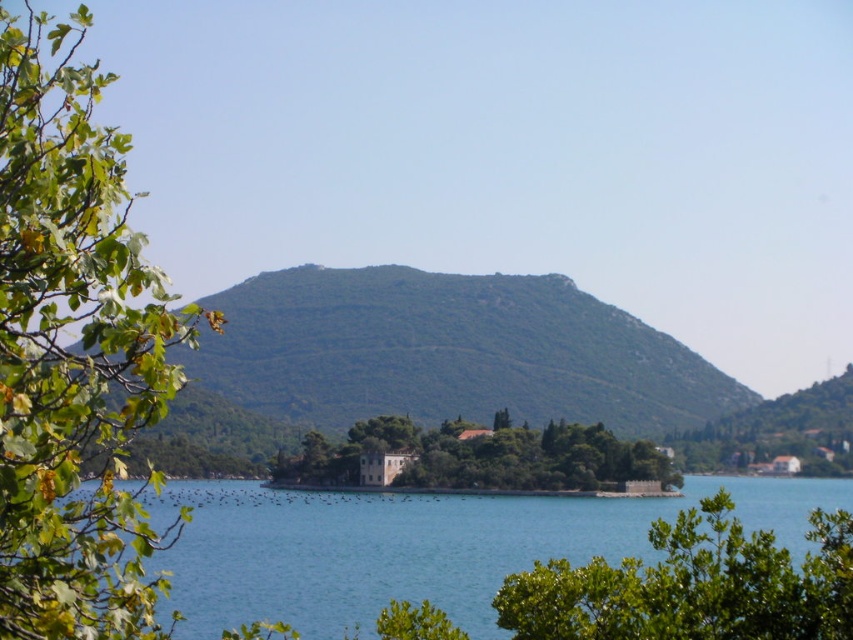
Question: Is green leafy tree at left to the left of clear blue water at center from the viewer's perspective?

Choices:
 (A) no
 (B) yes

Answer: (B)

Question: Which object is positioned closest to the clear blue water at center?

Choices:
 (A) green leafy tree at center
 (B) green leafy tree at left
 (C) green leafy tree at lower right
 (D) green textured hill at center

Answer: (A)

Question: Is clear blue water at center to the right of green leafy tree at lower right from the viewer's perspective?

Choices:
 (A) no
 (B) yes

Answer: (A)

Question: Can you confirm if green textured hill at center is positioned above green leafy tree at lower right?

Choices:
 (A) no
 (B) yes

Answer: (A)

Question: Which point is farther to the camera?

Choices:
 (A) (129, 307)
 (B) (379, 429)
 (C) (526, 328)
 (D) (276, 538)

Answer: (C)

Question: Among these objects, which one is farthest from the camera?

Choices:
 (A) green leafy tree at center
 (B) green leafy tree at left
 (C) green leafy tree at lower right

Answer: (A)